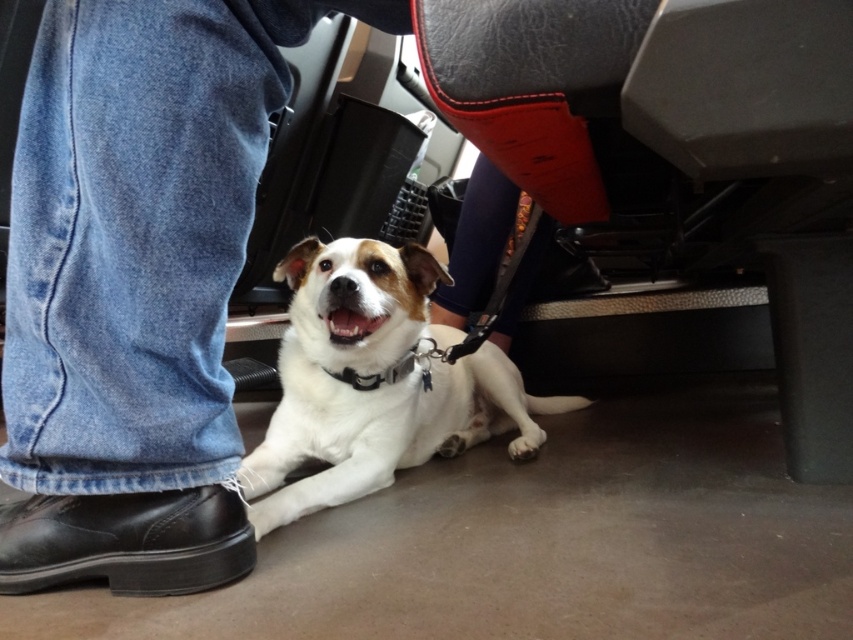
You are the owner of the small dog lying on the floor of the vehicle. You want to check if your dog is within reach of your foot. The dog is at the center of the image. Can you determine if your dog is within 0.2 units of your jeans at lower left?

The jeans at lower left is located at point (x=136, y=284). Since the dog is at the center of the image, which is point (x=426, y=320), the distance between them is sqrt of squared differences of coordinates. Calculating the distance between the dog at center and jeans at (x=136, y=284) would be sqrt of 0.055 squared plus 0.339 squared. That equals sqrt of 0.003025 plus 0.114921, which is sqrt of 0.117946, approximately 0.343 units. Since 0.343 is greater than 0.2, the dog is not within 0.2 units of the jeans at lower

You are a service robot in a vehicle. You need to move from the back of the vehicle to the front. There is a path between the jeans at lower left and the white fur dog at center. Can you pass through this path?

The jeans at lower left is positioned on the left side of white fur dog at center, so the path between them is narrow. Since the robot needs to move through this path, it should check the width between the jeans and the dog. If the width is sufficient for the robot to pass, then it can proceed. However, without knowing the exact width, the robot cannot confirm passage.